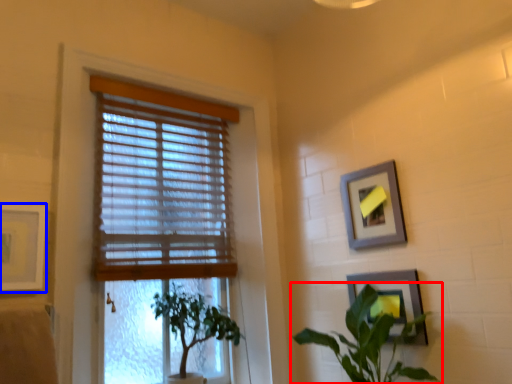
Question: Among these objects, which one is farthest to the camera, houseplant (highlighted by a red box) or picture frame (highlighted by a blue box)?

Choices:
 (A) houseplant
 (B) picture frame

Answer: (A)